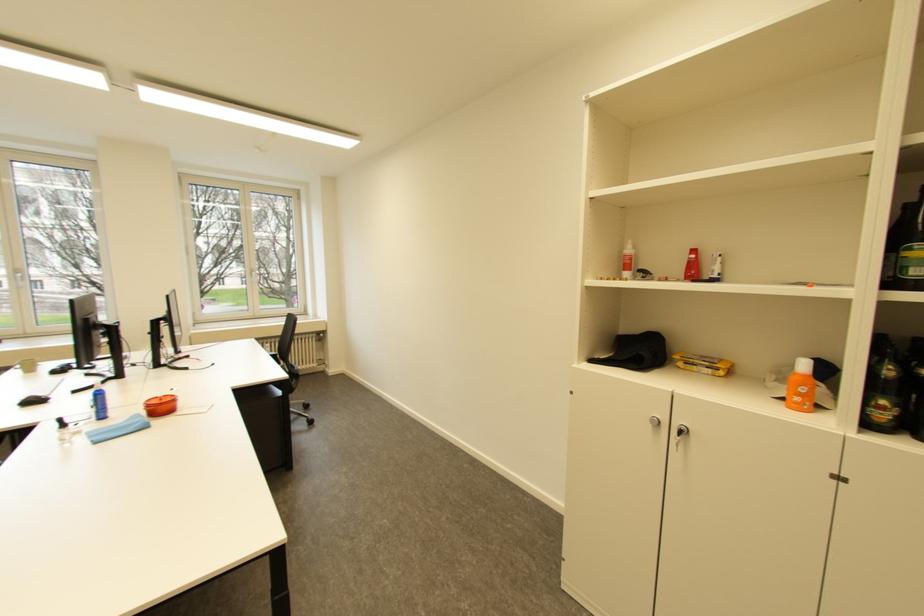
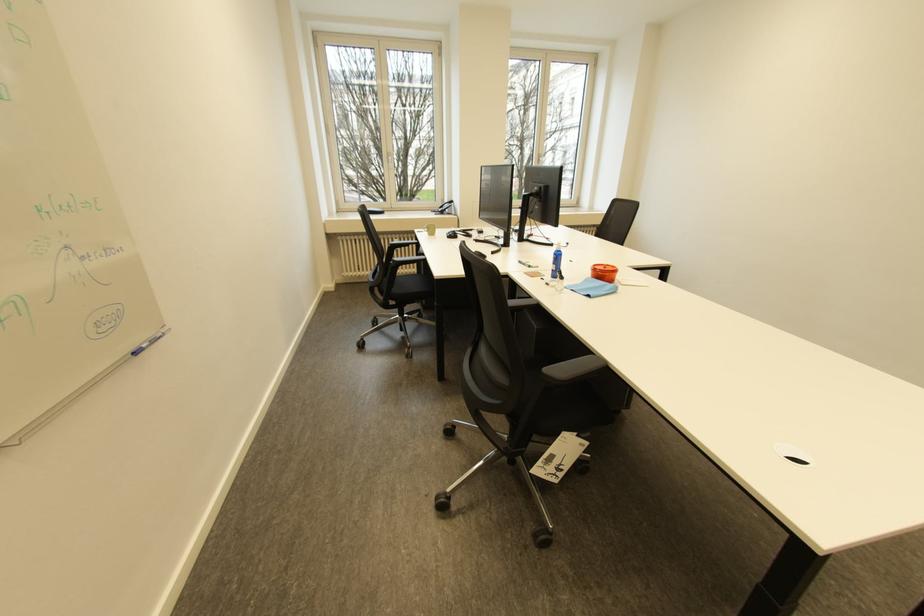
Where in the second image is the point corresponding to pixel 171 400 from the first image?

(614, 268)